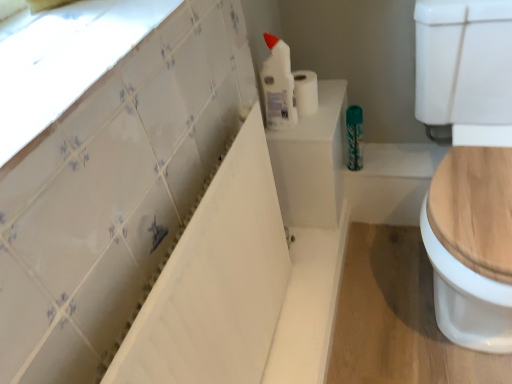
This screenshot has height=384, width=512. In order to click on vacant area that is in front of white matte toilet paper at upper center in this screenshot , I will do `click(315, 125)`.